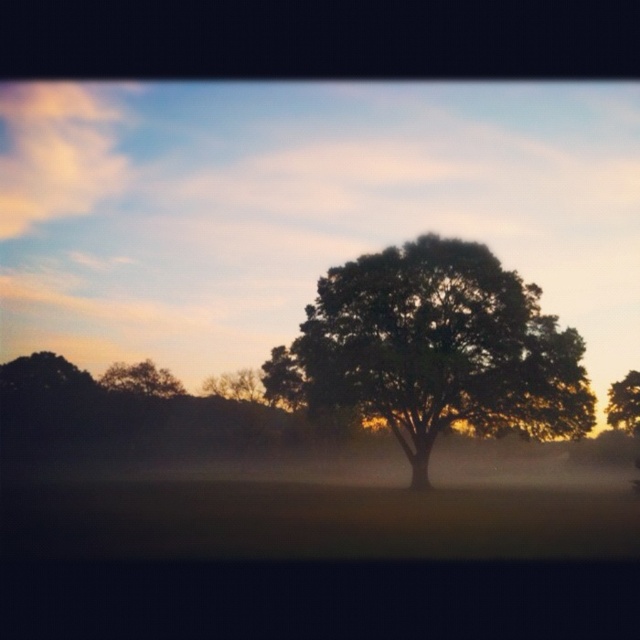
Is green leafy tree at center closer to the viewer compared to green leafy tree at right?

Yes.

Is point (476, 211) in front of point (627, 372)?

That is True.

Locate an element on the screen. green leafy tree at center is located at coordinates (301, 209).

Between point (435, 428) and point (618, 387), which one is positioned in front?

Point (435, 428)

The image size is (640, 640). In order to click on green leafy oak tree at center in this screenshot , I will do `click(435, 349)`.

Who is higher up, green leafy tree at left or green leafy tree at right?

Positioned higher is green leafy tree at left.

Is green leafy tree at left thinner than green leafy tree at right?

Correct, green leafy tree at left's width is less than green leafy tree at right's.

Which is in front, point (140, 371) or point (612, 426)?

Point (612, 426) is more forward.

Identify the location of green leafy tree at left. [141, 380].